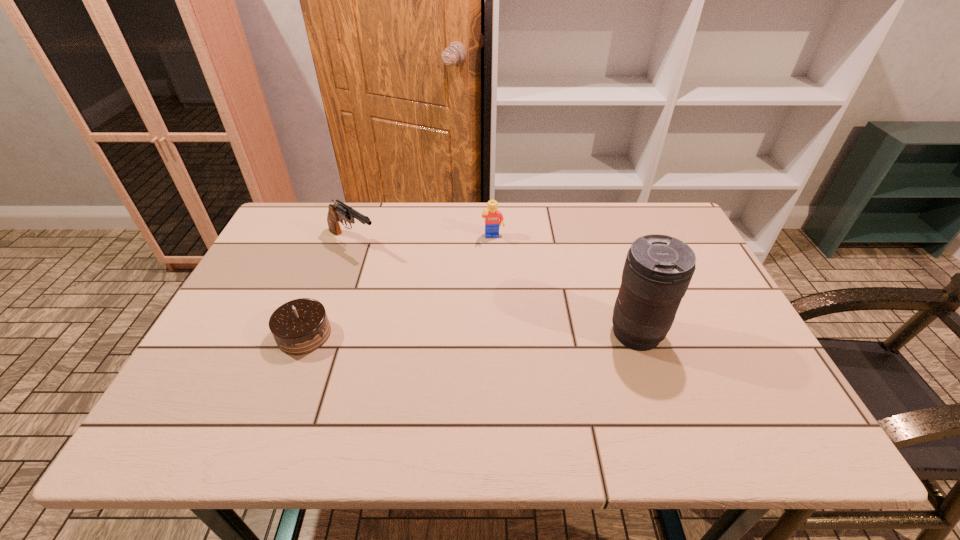
Where is `the shortest object`? The width and height of the screenshot is (960, 540). the shortest object is located at coordinates (300, 326).

Locate an element on the screen. The width and height of the screenshot is (960, 540). telephoto lens is located at coordinates (658, 269).

You are a GUI agent. You are given a task and a screenshot of the screen. Output one action in this format:
    pyautogui.click(x=<x>, y=<y>)
    Task: Click on the rightmost object
    This screenshot has width=960, height=540.
    Given the screenshot: What is the action you would take?
    pyautogui.click(x=658, y=269)

Find the location of a particular element. Lego is located at coordinates (492, 215).

Locate an element on the screen. This screenshot has height=540, width=960. gun is located at coordinates (337, 212).

I want to click on free space located on the back of the chocolate cake, so click(x=335, y=255).

The height and width of the screenshot is (540, 960). What are the coordinates of `free space located 0.300m on the side of the rightmost object where the control switches are located` in the screenshot? It's located at (485, 333).

Identify the location of free point located 0.240m on the side of the rightmost object where the control switches are located. (509, 333).

At what (x,y) coordinates should I click in order to perform the action: click on vacant area situated 0.120m on the side of the rightmost object where the control switches are located. Please return your answer as a coordinate pair (x, y). Looking at the image, I should click on (559, 333).

I want to click on free space located 0.240m on the face of the second object from right to left, so click(502, 299).